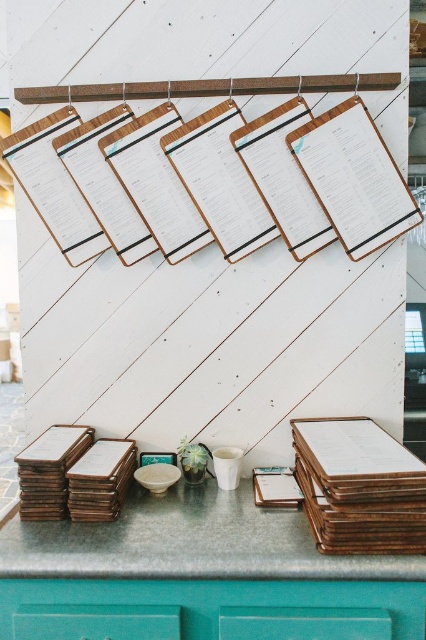
Is point (299, 476) less distant than point (198, 476)?

Yes, point (299, 476) is in front of point (198, 476).

Is wooden clipboard at lower right positioned at the back of teal glass vase at center?

No, it is not.

The width and height of the screenshot is (426, 640). I want to click on wooden clipboard at lower right, so click(359, 486).

You are a GUI agent. You are given a task and a screenshot of the screen. Output one action in this format:
    pyautogui.click(x=<x>, y=<y>)
    Task: Click on the wooden clipboard at lower right
    The height and width of the screenshot is (640, 426).
    Given the screenshot: What is the action you would take?
    pyautogui.click(x=359, y=486)

Does metallic green counter at bottom appear over teal glass vase at center?

No.

Is metallic green counter at bottom to the left of teal glass vase at center from the viewer's perspective?

No, metallic green counter at bottom is not to the left of teal glass vase at center.

Is point (141, 561) closer to camera compared to point (193, 461)?

Yes.

Find the location of a particular element. The height and width of the screenshot is (640, 426). metallic green counter at bottom is located at coordinates (189, 541).

Which of these two, metallic green counter at bottom or wooden clipboard at lower right, stands taller?

With more height is wooden clipboard at lower right.

Does metallic green counter at bottom have a smaller size compared to wooden clipboard at lower right?

No, metallic green counter at bottom is not smaller than wooden clipboard at lower right.

Which is behind, point (267, 515) or point (354, 513)?

The point (267, 515) is more distant.

Locate an element on the screen. This screenshot has height=640, width=426. metallic green counter at bottom is located at coordinates pos(189,541).